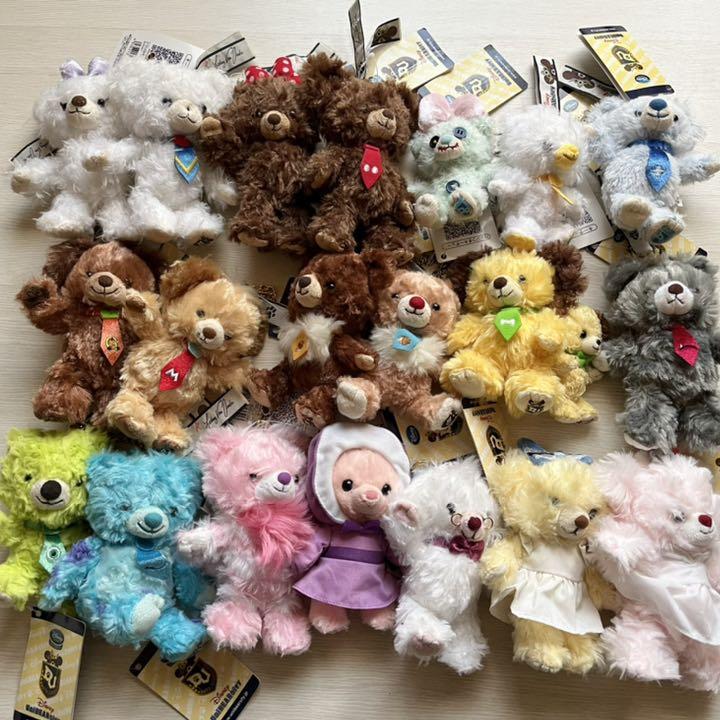
Locate an element on the screen. The height and width of the screenshot is (720, 720). stuffed bears in the topmost row is located at coordinates (78, 142), (158, 163), (261, 150), (356, 166), (459, 166), (551, 173), (641, 165).